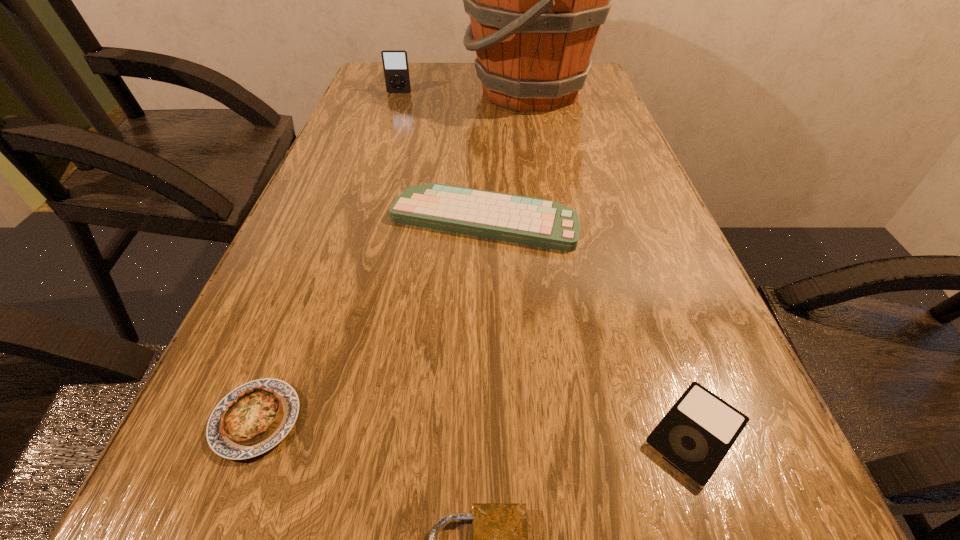
Locate an element on the screen. Image resolution: width=960 pixels, height=540 pixels. the tallest object is located at coordinates point(536,0).

Locate an element on the screen. This screenshot has width=960, height=540. the second tallest object is located at coordinates (395, 61).

The height and width of the screenshot is (540, 960). What are the coordinates of `the farther iPod` in the screenshot? It's located at (395, 61).

Identify the location of the fourth shortest object. This screenshot has height=540, width=960. (544, 223).

Where is `computer keyboard`? The image size is (960, 540). computer keyboard is located at coordinates (544, 223).

In order to click on quiche in this screenshot , I will do `click(253, 418)`.

Image resolution: width=960 pixels, height=540 pixels. Find the location of `the right iPod`. the right iPod is located at coordinates (695, 435).

Image resolution: width=960 pixels, height=540 pixels. I want to click on the shorter iPod, so click(x=695, y=435).

In order to click on blank space located on the handle side of the tallest object in this screenshot , I will do `click(358, 92)`.

Find the location of a particular element. Image resolution: width=960 pixels, height=540 pixels. vacant point located on the handle side of the tallest object is located at coordinates (374, 92).